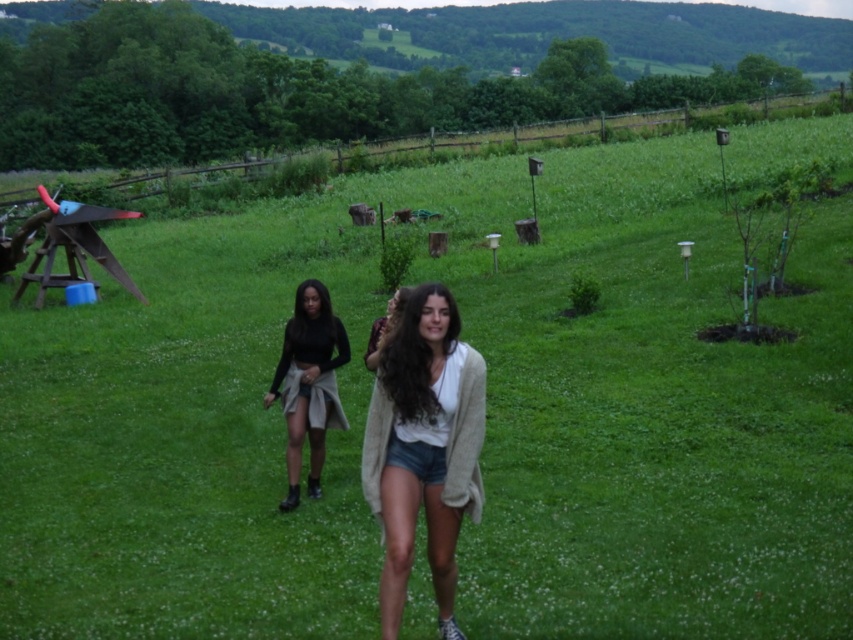
Who is positioned more to the right, light beige sweater at center or matte black top at center?

light beige sweater at center

Does point (395, 433) lie behind point (326, 326)?

That is False.

This screenshot has height=640, width=853. Find the location of `light beige sweater at center`. light beige sweater at center is located at coordinates (424, 449).